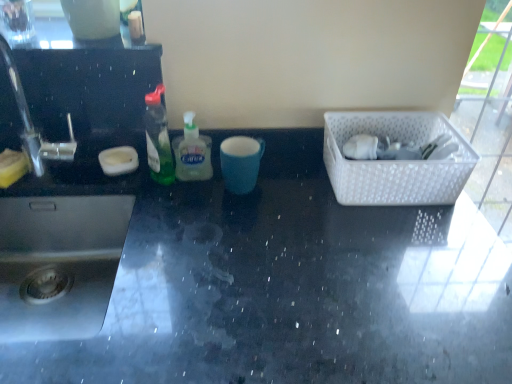
In order to face green translucent bottle at center, placed as the first bottle when sorted from left to right, should I rotate leftwards or rightwards?

You should look left and rotate roughly 12.823 degrees.

How much space does translucent green liquid soap at center, marked as the second bottle in a left-to-right arrangement, occupy vertically?

The height of translucent green liquid soap at center, marked as the second bottle in a left-to-right arrangement, is 16.35 centimeters.

You are a GUI agent. You are given a task and a screenshot of the screen. Output one action in this format:
    pyautogui.click(x=<x>, y=<y>)
    Task: Click on the green translucent bottle at center, acting as the 2th bottle starting from the right
    
    Given the screenshot: What is the action you would take?
    point(158,139)

Between white plastic basket at right and translucent green liquid soap at center, marked as the second bottle in a left-to-right arrangement, which one has more height?

Standing taller between the two is translucent green liquid soap at center, marked as the second bottle in a left-to-right arrangement.

From a real-world perspective, between white plastic basket at right and translucent green liquid soap at center, marked as the second bottle in a left-to-right arrangement, who is vertically lower?

From a 3D spatial view, white plastic basket at right is below.

How different are the orientations of white plastic basket at right and translucent green liquid soap at center, marked as the first bottle in a right-to-left arrangement, in degrees?

The facing directions of white plastic basket at right and translucent green liquid soap at center, marked as the first bottle in a right-to-left arrangement, are 0.836 degrees apart.

Considering the relative sizes of white plastic basket at right and translucent green liquid soap at center, marked as the first bottle in a right-to-left arrangement, in the image provided, is white plastic basket at right wider than translucent green liquid soap at center, marked as the first bottle in a right-to-left arrangement,?

Correct, the width of white plastic basket at right exceeds that of translucent green liquid soap at center, marked as the first bottle in a right-to-left arrangement.

From the picture: Between translucent green liquid soap at center, marked as the first bottle in a right-to-left arrangement, and black glossy countertop at center, which one has smaller width?

translucent green liquid soap at center, marked as the first bottle in a right-to-left arrangement.

From a real-world perspective, relative to black glossy countertop at center, is translucent green liquid soap at center, marked as the second bottle in a left-to-right arrangement, vertically above or below?

In terms of real-world spatial position, translucent green liquid soap at center, marked as the second bottle in a left-to-right arrangement, is above black glossy countertop at center.

Which of these two, translucent green liquid soap at center, marked as the first bottle in a right-to-left arrangement, or black glossy countertop at center, stands shorter?

Standing shorter between the two is translucent green liquid soap at center, marked as the first bottle in a right-to-left arrangement.

Considering the positions of points (184, 170) and (195, 244), is point (184, 170) farther from camera compared to point (195, 244)?

Yes, it is behind point (195, 244).

Is black glossy countertop at center positioned far away from white plastic basket at right?

No, black glossy countertop at center is not far away from white plastic basket at right.

Which object is thinner, black glossy countertop at center or white plastic basket at right?

white plastic basket at right.

From the image's perspective, which is above, black glossy countertop at center or white plastic basket at right?

From the image's view, white plastic basket at right is above.

Based on the photo, would you say black glossy countertop at center is inside or outside white plastic basket at right?

black glossy countertop at center exists outside the volume of white plastic basket at right.

Is white plastic basket at right completely or partially inside translucent green liquid soap at center, marked as the first bottle in a right-to-left arrangement?

No, white plastic basket at right is not a part of translucent green liquid soap at center, marked as the first bottle in a right-to-left arrangement.

Is translucent green liquid soap at center, marked as the second bottle in a left-to-right arrangement, facing towards white plastic basket at right?

No, translucent green liquid soap at center, marked as the second bottle in a left-to-right arrangement, is not facing towards white plastic basket at right.

Is translucent green liquid soap at center, marked as the first bottle in a right-to-left arrangement, in front of or behind white plastic basket at right in the image?

translucent green liquid soap at center, marked as the first bottle in a right-to-left arrangement, is behind white plastic basket at right.

Based on the photo, considering the positions of objects translucent green liquid soap at center, marked as the first bottle in a right-to-left arrangement, and white plastic basket at right in the image provided, who is more to the left, translucent green liquid soap at center, marked as the first bottle in a right-to-left arrangement, or white plastic basket at right?

translucent green liquid soap at center, marked as the first bottle in a right-to-left arrangement.

How many degrees apart are the facing directions of black glossy countertop at center and translucent green liquid soap at center, marked as the second bottle in a left-to-right arrangement?

The angular difference between black glossy countertop at center and translucent green liquid soap at center, marked as the second bottle in a left-to-right arrangement, is 1.54 degrees.

Does black glossy countertop at center have a lesser width compared to translucent green liquid soap at center, marked as the second bottle in a left-to-right arrangement?

No, black glossy countertop at center is not thinner than translucent green liquid soap at center, marked as the second bottle in a left-to-right arrangement.

Which is behind, point (344, 282) or point (197, 155)?

The point (197, 155) is behind.

Where is `bottle that is the 1st object located above the black glossy countertop at center (from the image's perspective)`? This screenshot has height=384, width=512. bottle that is the 1st object located above the black glossy countertop at center (from the image's perspective) is located at coordinates (192, 152).

Does green translucent bottle at center, acting as the 2th bottle starting from the right, turn towards white plastic basket at right?

No, green translucent bottle at center, acting as the 2th bottle starting from the right, is not turned towards white plastic basket at right.

Which object is positioned more to the left, green translucent bottle at center, placed as the first bottle when sorted from left to right, or white plastic basket at right?

green translucent bottle at center, placed as the first bottle when sorted from left to right, is more to the left.

Is green translucent bottle at center, placed as the first bottle when sorted from left to right, not near white plastic basket at right?

They are positioned close to each other.

From a real-world perspective, is green translucent bottle at center, acting as the 2th bottle starting from the right, above or below white plastic basket at right?

green translucent bottle at center, acting as the 2th bottle starting from the right, is above white plastic basket at right.

Who is bigger, black glossy countertop at center or green translucent bottle at center, placed as the first bottle when sorted from left to right?

black glossy countertop at center.

From the image's perspective, which bottle is the 2nd one above the black glossy countertop at center? Please provide its 2D coordinates.

[(158, 139)]

From the image's perspective, relative to green translucent bottle at center, placed as the first bottle when sorted from left to right, is black glossy countertop at center above or below?

black glossy countertop at center is below green translucent bottle at center, placed as the first bottle when sorted from left to right.

Could you tell me if black glossy countertop at center is facing green translucent bottle at center, placed as the first bottle when sorted from left to right?

No.

Locate an element on the screen. The width and height of the screenshot is (512, 384). basket in front of the translucent green liquid soap at center, marked as the second bottle in a left-to-right arrangement is located at coordinates (395, 161).

From a real-world perspective, starting from the black glossy countertop at center, which bottle is the 1st one vertically above it? Please provide its 2D coordinates.

[(192, 152)]

From the image, which object appears to be nearer to translucent green liquid soap at center, marked as the first bottle in a right-to-left arrangement, white plastic basket at right or green translucent bottle at center, placed as the first bottle when sorted from left to right?

green translucent bottle at center, placed as the first bottle when sorted from left to right.

Estimate the real-world distances between objects in this image. Which object is closer to green translucent bottle at center, placed as the first bottle when sorted from left to right, white plastic basket at right or translucent green liquid soap at center, marked as the first bottle in a right-to-left arrangement?

translucent green liquid soap at center, marked as the first bottle in a right-to-left arrangement, is positioned closer to the anchor green translucent bottle at center, placed as the first bottle when sorted from left to right.

Looking at the image, which one is located closer to black glossy countertop at center, green translucent bottle at center, placed as the first bottle when sorted from left to right, or white plastic basket at right?

white plastic basket at right.

Estimate the real-world distances between objects in this image. Which object is closer to black glossy countertop at center, white plastic basket at right or green translucent bottle at center, placed as the first bottle when sorted from left to right?

Among the two, white plastic basket at right is located nearer to black glossy countertop at center.

Based on their spatial positions, is translucent green liquid soap at center, marked as the second bottle in a left-to-right arrangement, or green translucent bottle at center, acting as the 2th bottle starting from the right, further from white plastic basket at right?

Based on the image, green translucent bottle at center, acting as the 2th bottle starting from the right, appears to be further to white plastic basket at right.

Based on their spatial positions, is green translucent bottle at center, placed as the first bottle when sorted from left to right, or white plastic basket at right further from translucent green liquid soap at center, marked as the second bottle in a left-to-right arrangement?

Based on the image, white plastic basket at right appears to be further to translucent green liquid soap at center, marked as the second bottle in a left-to-right arrangement.

When comparing their distances from white plastic basket at right, does green translucent bottle at center, placed as the first bottle when sorted from left to right, or black glossy countertop at center seem further?

green translucent bottle at center, placed as the first bottle when sorted from left to right.

Based on their spatial positions, is green translucent bottle at center, placed as the first bottle when sorted from left to right, or black glossy countertop at center further from translucent green liquid soap at center, marked as the first bottle in a right-to-left arrangement?

black glossy countertop at center is further to translucent green liquid soap at center, marked as the first bottle in a right-to-left arrangement.

Identify the location of basket between translucent green liquid soap at center, marked as the second bottle in a left-to-right arrangement, and black glossy countertop at center vertically. (395, 161).

The image size is (512, 384). I want to click on basket between green translucent bottle at center, acting as the 2th bottle starting from the right, and black glossy countertop at center in the up-down direction, so click(x=395, y=161).

At what (x,y) coordinates should I click in order to perform the action: click on bottle between green translucent bottle at center, acting as the 2th bottle starting from the right, and black glossy countertop at center in the up-down direction. Please return your answer as a coordinate pair (x, y). This screenshot has width=512, height=384. Looking at the image, I should click on (192, 152).

Where is `bottle between green translucent bottle at center, acting as the 2th bottle starting from the right, and white plastic basket at right from left to right`? This screenshot has height=384, width=512. bottle between green translucent bottle at center, acting as the 2th bottle starting from the right, and white plastic basket at right from left to right is located at coordinates (192, 152).